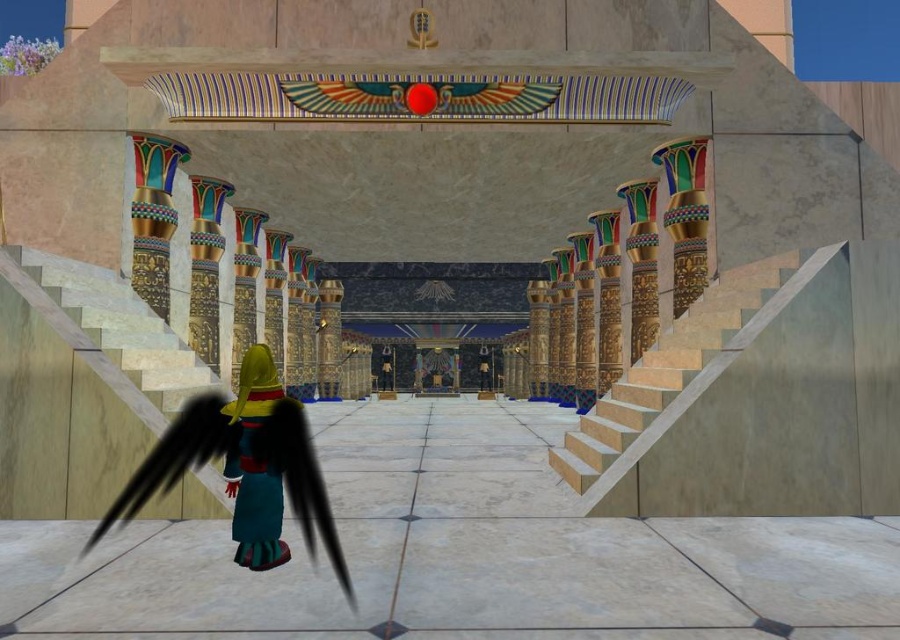
Question: Is beige marble stairs at right positioned at the back of velvet teal robe at lower left?

Choices:
 (A) yes
 (B) no

Answer: (A)

Question: Is beige marble stairs at right to the left of velvet teal robe at lower left from the viewer's perspective?

Choices:
 (A) yes
 (B) no

Answer: (B)

Question: Is beige marble stairs at right to the left of velvet teal robe at lower left from the viewer's perspective?

Choices:
 (A) yes
 (B) no

Answer: (B)

Question: Which point is farther from the camera taking this photo?

Choices:
 (A) (130, 406)
 (B) (695, 364)
 (C) (275, 522)

Answer: (B)

Question: Which point appears closest to the camera in this image?

Choices:
 (A) tap(634, 419)
 (B) tap(159, 419)
 (C) tap(243, 435)

Answer: (C)

Question: Among these points, which one is nearest to the camera?

Choices:
 (A) (641, 358)
 (B) (207, 500)
 (C) (237, 561)

Answer: (C)